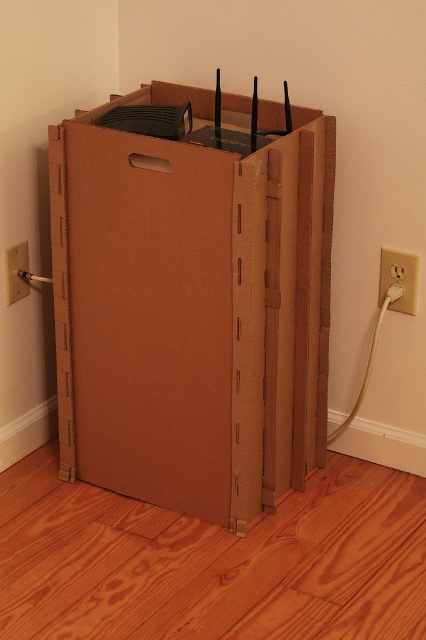
Does white plastic outlet at lower right appear on the right side of white plastic electric outlet at lower right?

Yes, white plastic outlet at lower right is to the right of white plastic electric outlet at lower right.

This screenshot has width=426, height=640. What do you see at coordinates (400, 276) in the screenshot?
I see `white plastic outlet at lower right` at bounding box center [400, 276].

Which is behind, point (394, 280) or point (16, 253)?

Point (16, 253)

Identify the location of white plastic outlet at lower right. The height and width of the screenshot is (640, 426). (400, 276).

Does brown cardboard box at center have a greater width compared to white plastic electric outlet at lower right?

Correct, the width of brown cardboard box at center exceeds that of white plastic electric outlet at lower right.

Can you confirm if brown cardboard box at center is shorter than white plastic electric outlet at lower right?

No.

This screenshot has height=640, width=426. Describe the element at coordinates (192, 301) in the screenshot. I see `brown cardboard box at center` at that location.

Locate an element on the screen. brown cardboard box at center is located at coordinates (192, 301).

Between brown cardboard box at center and white plastic outlet at lower right, which one is positioned lower?

brown cardboard box at center is below.

Which of these two, brown cardboard box at center or white plastic outlet at lower right, stands taller?

Standing taller between the two is brown cardboard box at center.

Find the location of a particular element. brown cardboard box at center is located at coordinates (192, 301).